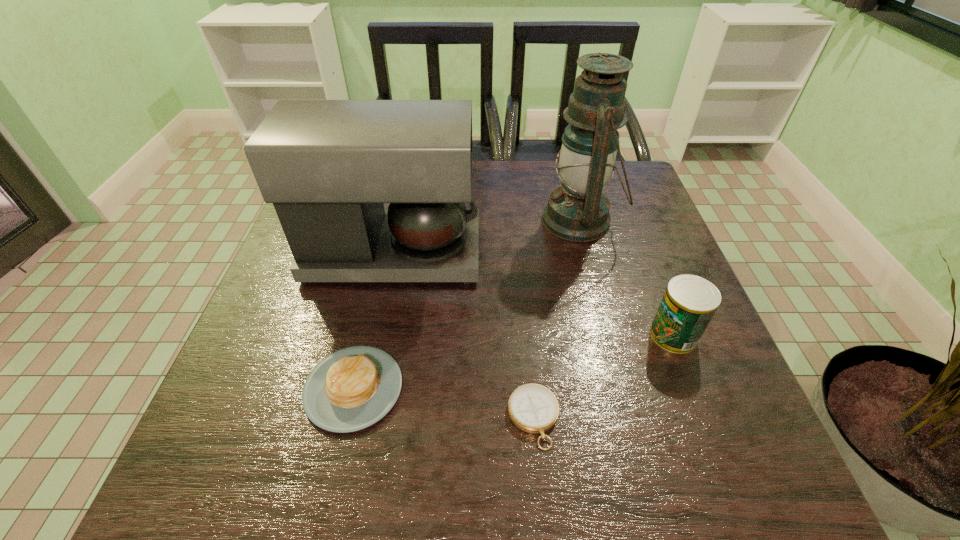
The height and width of the screenshot is (540, 960). In order to click on the tallest object in this screenshot , I will do `click(578, 211)`.

Identify the location of coffee maker. Image resolution: width=960 pixels, height=540 pixels. (327, 166).

At what (x,y) coordinates should I click in order to perform the action: click on the third shortest object. Please return your answer as a coordinate pair (x, y). This screenshot has width=960, height=540. Looking at the image, I should click on (689, 302).

I want to click on pancake, so click(351, 389).

Find the location of a particular element. This screenshot has height=540, width=960. the third object from right to left is located at coordinates (533, 408).

What are the coordinates of `the shortest object` in the screenshot? It's located at (533, 408).

Find the location of `vacant space located 0.300m on the front of the tallest object`. vacant space located 0.300m on the front of the tallest object is located at coordinates (615, 360).

Identify the location of free space located on the carafe side of the fourth shortest object. Image resolution: width=960 pixels, height=540 pixels. (516, 254).

Find the location of a particular element. vacant area situated 0.150m on the left of the can is located at coordinates (576, 335).

The width and height of the screenshot is (960, 540). Identify the location of free space located 0.320m on the right of the second shortest object. (579, 389).